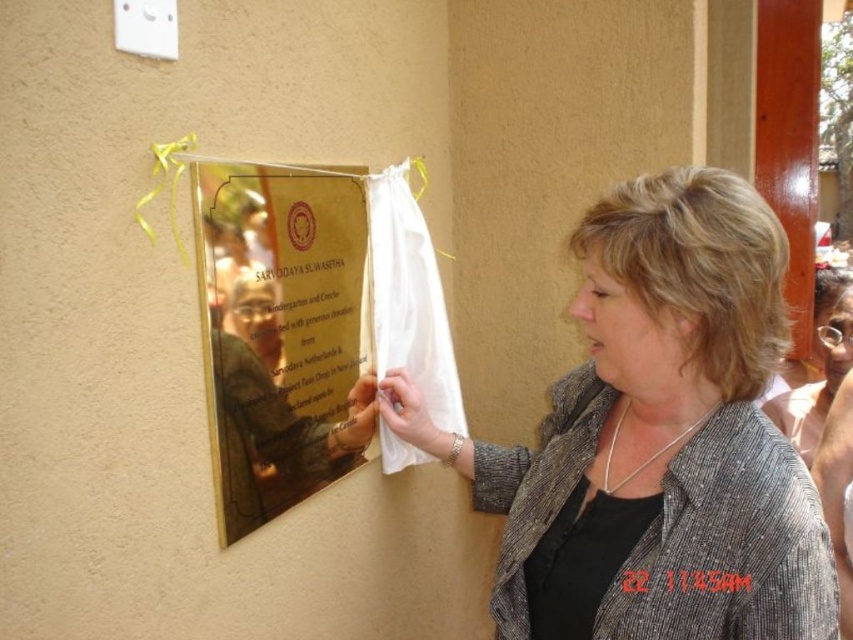
Measure the distance between gray textured blazer at center and gold polished metal plaque at upper left.

gray textured blazer at center is 15.86 inches from gold polished metal plaque at upper left.

Is point (741, 298) more distant than point (363, 403)?

No.

You are a GUI agent. You are given a task and a screenshot of the screen. Output one action in this format:
    pyautogui.click(x=<x>, y=<y>)
    Task: Click on the gray textured blazer at center
    
    Given the screenshot: What is the action you would take?
    pyautogui.click(x=656, y=438)